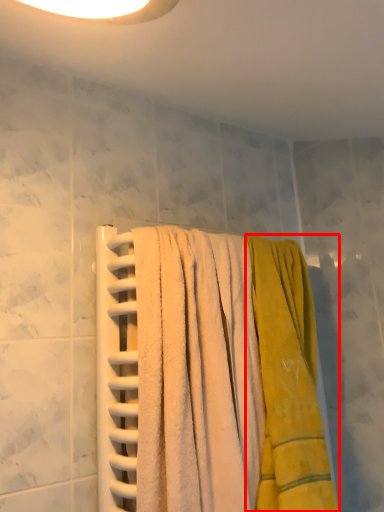
Question: Where is towel (annotated by the red box) located in relation to towel in the image?

Choices:
 (A) left
 (B) right

Answer: (B)